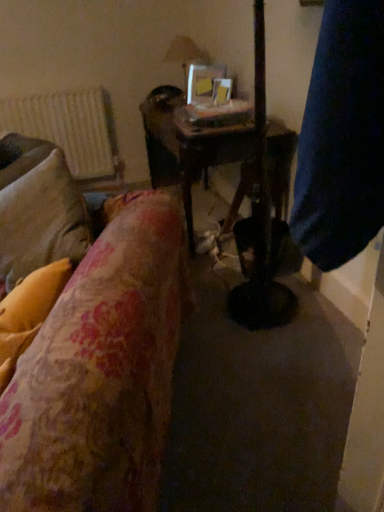
Question: Does floral fabric pillow at left have a lesser width compared to wooden table at center?

Choices:
 (A) no
 (B) yes

Answer: (B)

Question: Considering the relative sizes of floral fabric pillow at left and wooden table at center in the image provided, is floral fabric pillow at left bigger than wooden table at center?

Choices:
 (A) yes
 (B) no

Answer: (B)

Question: Considering the relative positions of floral fabric pillow at left and wooden table at center in the image provided, is floral fabric pillow at left to the right of wooden table at center from the viewer's perspective?

Choices:
 (A) yes
 (B) no

Answer: (B)

Question: Can you confirm if floral fabric pillow at left is smaller than wooden table at center?

Choices:
 (A) yes
 (B) no

Answer: (A)

Question: Can you confirm if floral fabric pillow at left is shorter than wooden table at center?

Choices:
 (A) yes
 (B) no

Answer: (A)

Question: Considering the positions of floral fabric pillow at left and wooden table at center in the image, is floral fabric pillow at left bigger or smaller than wooden table at center?

Choices:
 (A) small
 (B) big

Answer: (A)

Question: Is point (13, 301) positioned closer to the camera than point (291, 133)?

Choices:
 (A) farther
 (B) closer

Answer: (B)

Question: In the image, is floral fabric pillow at left on the left side or the right side of wooden table at center?

Choices:
 (A) left
 (B) right

Answer: (A)

Question: Which is correct: floral fabric pillow at left is inside wooden table at center, or outside of it?

Choices:
 (A) outside
 (B) inside

Answer: (A)

Question: Would you say wooden table at center is to the left or to the right of white textured radiator at upper left in the picture?

Choices:
 (A) left
 (B) right

Answer: (B)

Question: Would you say wooden table at center is inside or outside white textured radiator at upper left?

Choices:
 (A) inside
 (B) outside

Answer: (B)

Question: From a real-world perspective, is wooden table at center above or below white textured radiator at upper left?

Choices:
 (A) below
 (B) above

Answer: (A)

Question: Is wooden table at center in front of or behind white textured radiator at upper left in the image?

Choices:
 (A) front
 (B) behind

Answer: (A)

Question: Visually, is clear glass lampshade at upper center positioned to the left or to the right of floral fabric pillow at left?

Choices:
 (A) left
 (B) right

Answer: (B)

Question: Based on their sizes in the image, would you say clear glass lampshade at upper center is bigger or smaller than floral fabric pillow at left?

Choices:
 (A) big
 (B) small

Answer: (B)